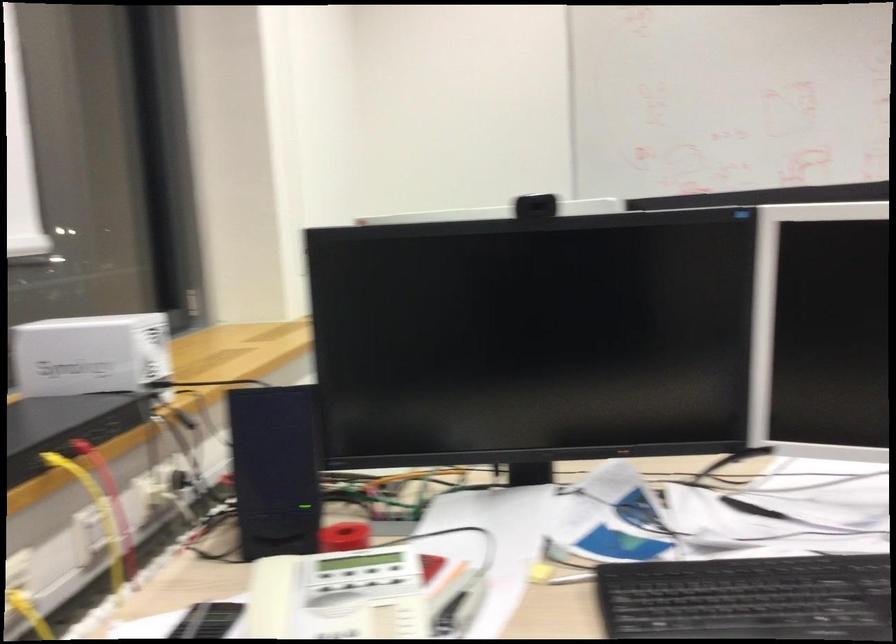
Locate an element on the screen. silver pen is located at coordinates (572, 578).